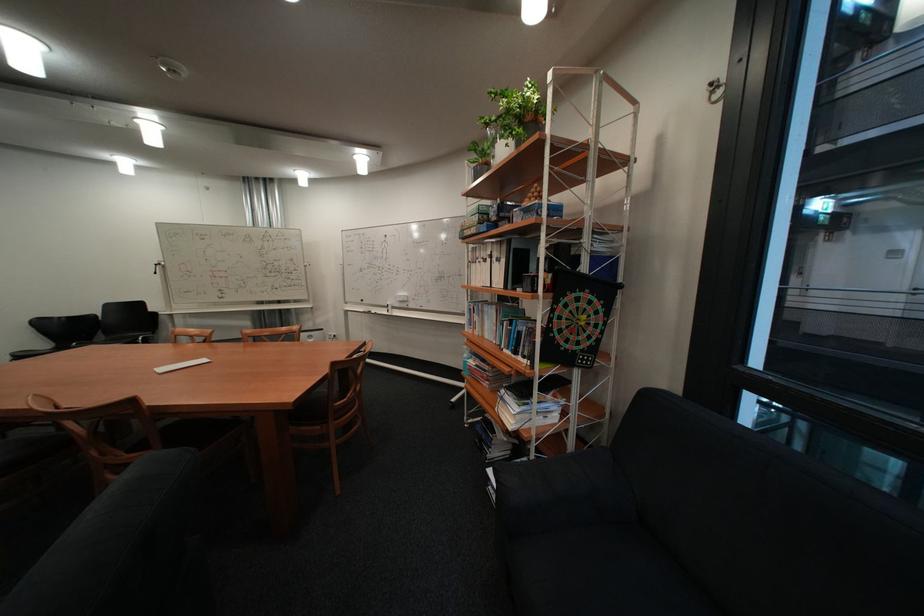
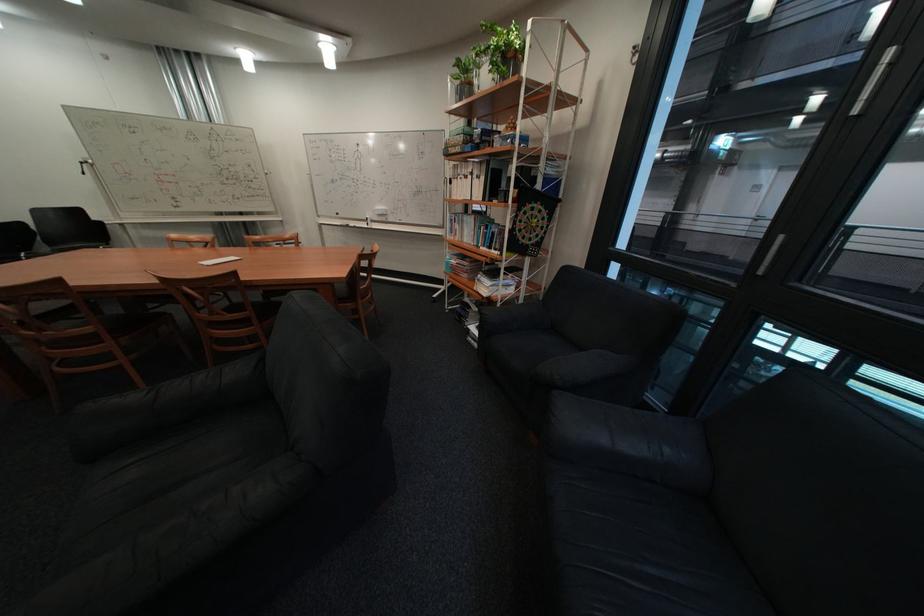
The point at (492, 262) is marked in the first image. Where is the corresponding point in the second image?

(475, 177)